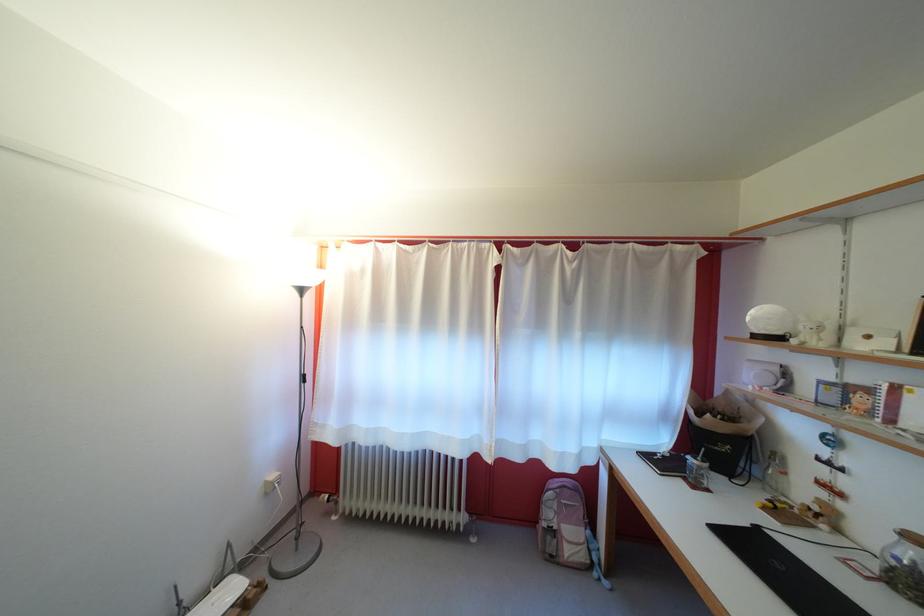
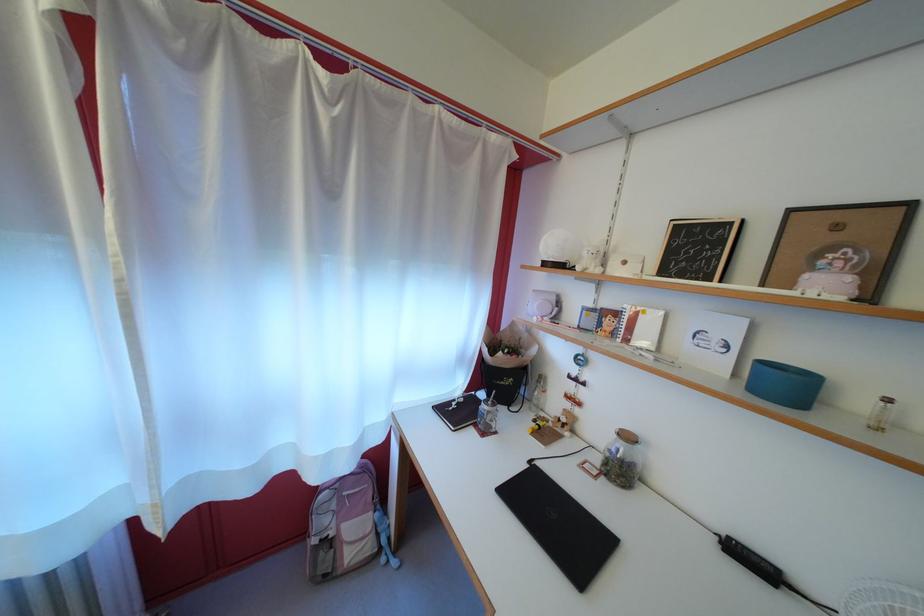
In the second image, find the point that corresponds to (x=694, y=485) in the first image.

(483, 431)